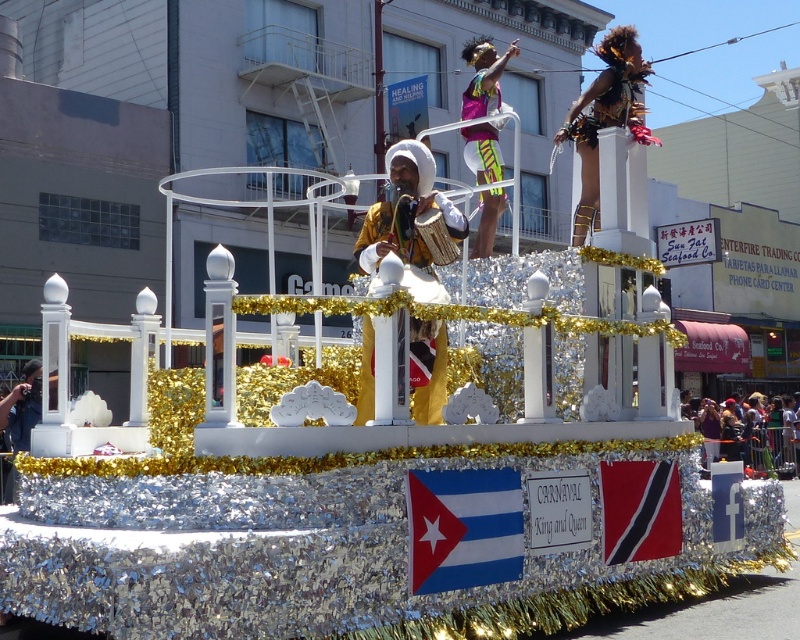
Question: Does shiny gold costume at center appear over matte black camera at lower right?

Choices:
 (A) yes
 (B) no

Answer: (A)

Question: Can you confirm if matte gold robe at center is bigger than matte black camera at lower right?

Choices:
 (A) no
 (B) yes

Answer: (A)

Question: Which point is closer to the camera?

Choices:
 (A) neon yellow fabric at center
 (B) matte gold robe at center
 (C) shiny gold costume at center

Answer: (B)

Question: Which object appears farthest from the camera in this image?

Choices:
 (A) shiny gold costume at center
 (B) neon yellow fabric at center
 (C) matte gold robe at center
 (D) matte black camera at lower right

Answer: (D)

Question: Is shiny gold costume at center wider than neon yellow fabric at center?

Choices:
 (A) no
 (B) yes

Answer: (B)

Question: Which point is farther from the camera taking this photo?

Choices:
 (A) (612, 67)
 (B) (372, 417)
 (C) (720, 426)
 (D) (490, 76)

Answer: (C)